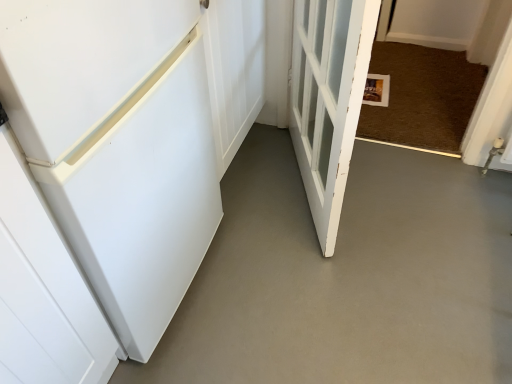
The height and width of the screenshot is (384, 512). Identify the location of space that is in front of white wooden door at center, which appears as the first door when viewed from the right. (327, 285).